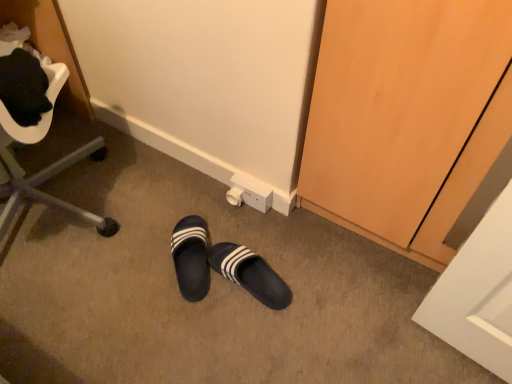
Question: Does black rubber slippers at center appear on the right side of black leather slippers at center?

Choices:
 (A) no
 (B) yes

Answer: (A)

Question: From the image's perspective, is black rubber slippers at center above black leather slippers at center?

Choices:
 (A) no
 (B) yes

Answer: (B)

Question: From the image's perspective, does black rubber slippers at center appear lower than black leather slippers at center?

Choices:
 (A) yes
 (B) no

Answer: (B)

Question: Can you confirm if black rubber slippers at center is taller than black leather slippers at center?

Choices:
 (A) no
 (B) yes

Answer: (A)

Question: Can you confirm if black rubber slippers at center is bigger than black leather slippers at center?

Choices:
 (A) yes
 (B) no

Answer: (A)

Question: Can you confirm if black rubber slippers at center is positioned to the left of black leather slippers at center?

Choices:
 (A) yes
 (B) no

Answer: (A)

Question: Does black leather slippers at center have a lesser height compared to black rubber slippers at center?

Choices:
 (A) yes
 (B) no

Answer: (B)

Question: Considering the relative positions of black leather slippers at center and black rubber slippers at center in the image provided, is black leather slippers at center behind black rubber slippers at center?

Choices:
 (A) yes
 (B) no

Answer: (B)

Question: Is black leather slippers at center turned away from black rubber slippers at center?

Choices:
 (A) no
 (B) yes

Answer: (B)

Question: Is black leather slippers at center completely or partially outside of black rubber slippers at center?

Choices:
 (A) yes
 (B) no

Answer: (A)

Question: Is black leather slippers at center to the right of black rubber slippers at center from the viewer's perspective?

Choices:
 (A) no
 (B) yes

Answer: (B)

Question: Is black rubber slippers at center completely or partially inside black leather slippers at center?

Choices:
 (A) no
 (B) yes

Answer: (A)

Question: Is metallic silver chair at left turned away from black leather slippers at center?

Choices:
 (A) no
 (B) yes

Answer: (A)